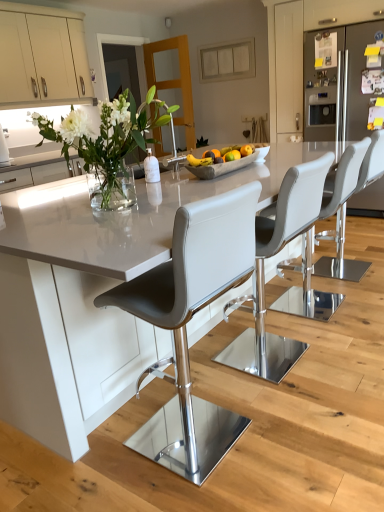
Where is `free spot to the right of matte gray bar stool at center, positioned as the fourth chair in back-to-front order`? This screenshot has height=512, width=384. free spot to the right of matte gray bar stool at center, positioned as the fourth chair in back-to-front order is located at coordinates (296, 434).